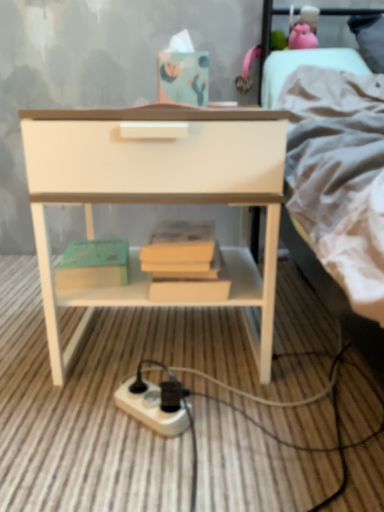
Find the location of `free space between white glossy nightstand at center and white plastic power plugs and sockets at lower center`. free space between white glossy nightstand at center and white plastic power plugs and sockets at lower center is located at coordinates (189, 420).